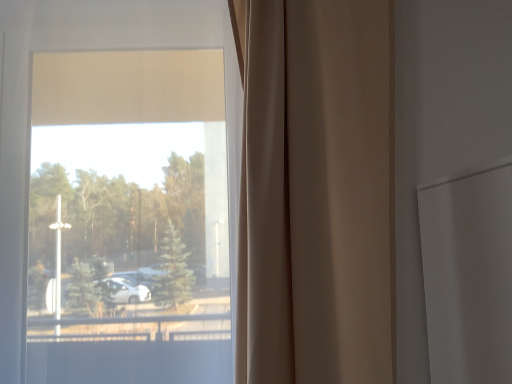
Question: From a real-world perspective, is beige fabric curtain at center located higher than transparent glass window at center?

Choices:
 (A) yes
 (B) no

Answer: (B)

Question: Is beige fabric curtain at center aimed at transparent glass window at center?

Choices:
 (A) yes
 (B) no

Answer: (B)

Question: Is the depth of beige fabric curtain at center greater than that of transparent glass window at center?

Choices:
 (A) no
 (B) yes

Answer: (A)

Question: Considering the relative positions of beige fabric curtain at center and transparent glass window at center in the image provided, is beige fabric curtain at center to the left of transparent glass window at center from the viewer's perspective?

Choices:
 (A) no
 (B) yes

Answer: (A)

Question: Is beige fabric curtain at center looking in the opposite direction of transparent glass window at center?

Choices:
 (A) yes
 (B) no

Answer: (B)

Question: Can you confirm if beige fabric curtain at center is shorter than transparent glass window at center?

Choices:
 (A) no
 (B) yes

Answer: (B)

Question: Is transparent glass window at center taller than beige fabric curtain at center?

Choices:
 (A) no
 (B) yes

Answer: (B)

Question: Does transparent glass window at center have a smaller size compared to beige fabric curtain at center?

Choices:
 (A) yes
 (B) no

Answer: (B)

Question: From a real-world perspective, is transparent glass window at center positioned over beige fabric curtain at center based on gravity?

Choices:
 (A) no
 (B) yes

Answer: (B)

Question: Is transparent glass window at center far away from beige fabric curtain at center?

Choices:
 (A) no
 (B) yes

Answer: (A)

Question: Could you tell me if transparent glass window at center is turned towards beige fabric curtain at center?

Choices:
 (A) yes
 (B) no

Answer: (B)

Question: Does transparent glass window at center come behind beige fabric curtain at center?

Choices:
 (A) yes
 (B) no

Answer: (A)

Question: From a real-world perspective, relative to transparent glass window at center, is beige fabric curtain at center vertically above or below?

Choices:
 (A) below
 (B) above

Answer: (A)